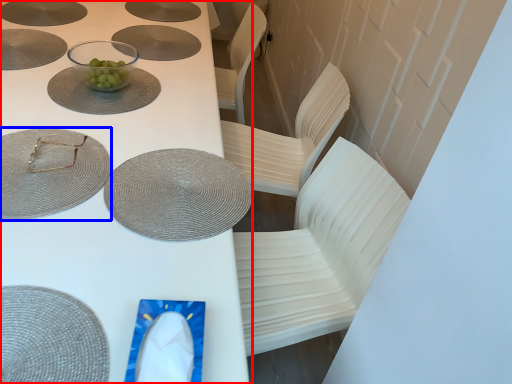
Question: Which object appears closest to the camera in this image, table (highlighted by a red box) or glass plate (highlighted by a blue box)?

Choices:
 (A) table
 (B) glass plate

Answer: (A)